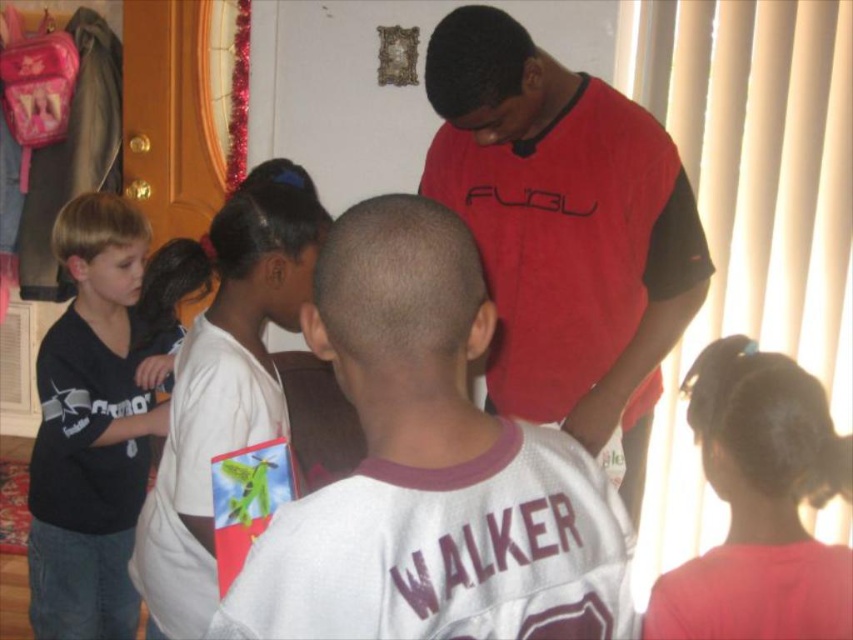
Question: Where is white jersey at center located in relation to dark brown hair at upper right in the image?

Choices:
 (A) left
 (B) right

Answer: (A)

Question: Considering the real-world distances, which object is farthest from the dark brown hair at upper right?

Choices:
 (A) black matte shirt at left
 (B) white jersey at center
 (C) red matte shirt at center

Answer: (A)

Question: Among these objects, which one is farthest from the camera?

Choices:
 (A) black matte shirt at left
 (B) red matte shirt at center
 (C) white jersey at center

Answer: (A)

Question: Which point is closer to the camera?

Choices:
 (A) red matte shirt at center
 (B) white jersey at center
 (C) dark brown hair at upper right

Answer: (B)

Question: Is the position of white jersey at center more distant than that of red matte shirt at center?

Choices:
 (A) yes
 (B) no

Answer: (B)

Question: Is black matte shirt at left further to camera compared to white matte shirt at upper left?

Choices:
 (A) yes
 (B) no

Answer: (A)